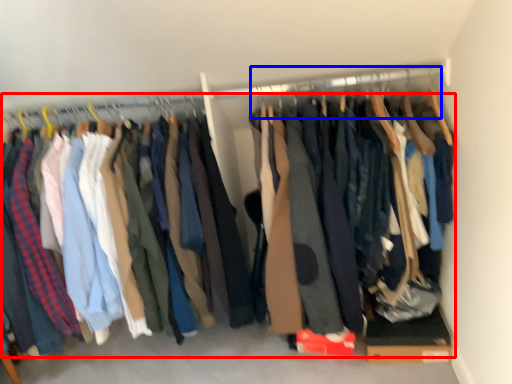
Question: Which of the following is the farthest to the observer, trousers (highlighted by a red box) or hanger (highlighted by a blue box)?

Choices:
 (A) trousers
 (B) hanger

Answer: (B)